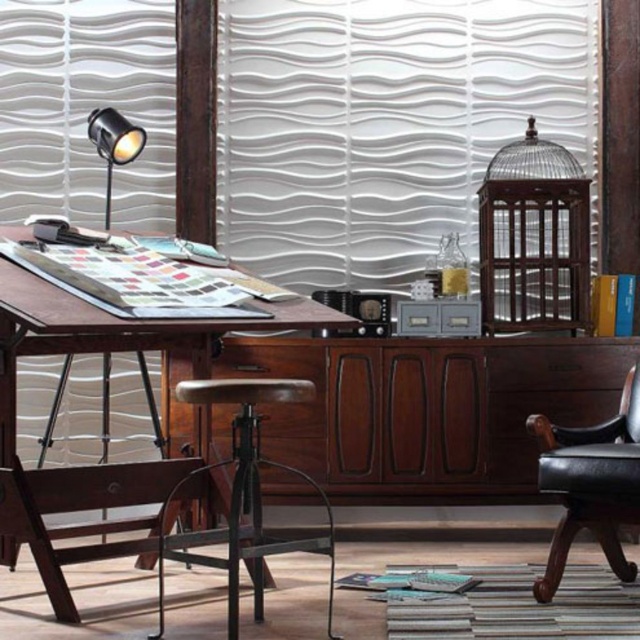
You are a designer who needs to move a 18 inch wide portfolio from the wooden drafting table at left to the rustic wood stool at center. Can you place the portfolio on the stool without moving either object?

The rustic wood stool at center and wooden drafting table at left are 18.19 inches apart, so the 18 inch wide portfolio can be placed on the stool without needing to move either object since the distance between them is sufficient.

You need to place a 1.2 meter wide box on the floor between the rustic wood stool at center and the wooden drafting table at left. Can the box fit there?

The rustic wood stool at center has a lesser width compared to wooden drafting table at left. Since the stool is narrower, the space between them might be sufficient for a 1.2 meter wide box. However, without knowing the exact distance between them, we cannot confirm if the box will fit. Please measure the available space before placing the box.